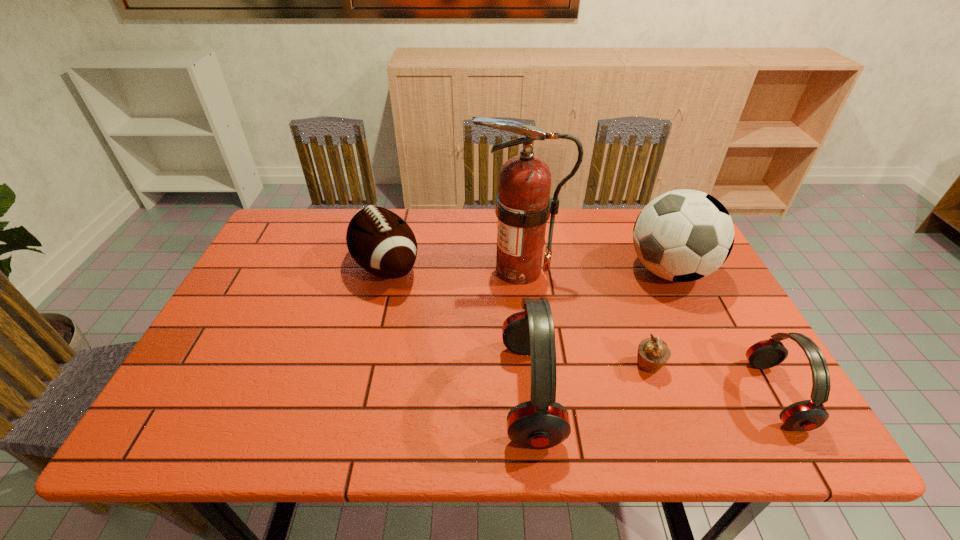
At what (x,y) coordinates should I click in order to perform the action: click on vacant space at the right edge. Please return your answer as a coordinate pair (x, y). Looking at the image, I should click on (675, 318).

Where is `vacant space at the far left corner`? This screenshot has height=540, width=960. vacant space at the far left corner is located at coordinates 307,219.

Find the location of a particular element. free space between the fire extinguisher and the shortest object is located at coordinates (584, 318).

The image size is (960, 540). In order to click on vacant area between the right earphone and the shortest object in this screenshot , I will do `click(712, 380)`.

Locate an element on the screen. This screenshot has height=540, width=960. unoccupied position between the shortest object and the soccer ball is located at coordinates (659, 318).

This screenshot has width=960, height=540. Identify the location of free space between the soccer ball and the left earphone. (600, 332).

What are the coordinates of `empty space that is in between the tallest object and the shorter earphone` in the screenshot? It's located at (647, 332).

Where is `free space between the leftmost object and the tallest object`? free space between the leftmost object and the tallest object is located at coordinates click(x=453, y=268).

Locate an element on the screen. The image size is (960, 540). free spot between the tallest object and the right earphone is located at coordinates (647, 332).

This screenshot has height=540, width=960. I want to click on free space between the shorter earphone and the soccer ball, so click(722, 333).